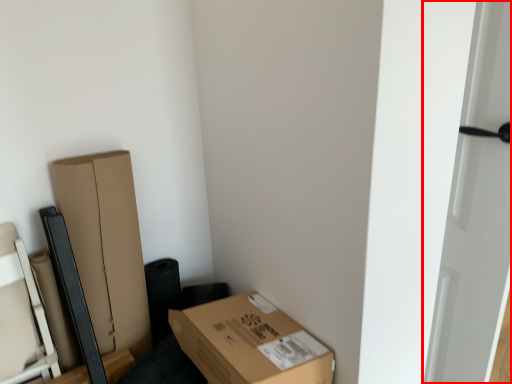
Question: Observing the image, what is the correct spatial positioning of door (annotated by the red box) in reference to box?

Choices:
 (A) right
 (B) left

Answer: (A)